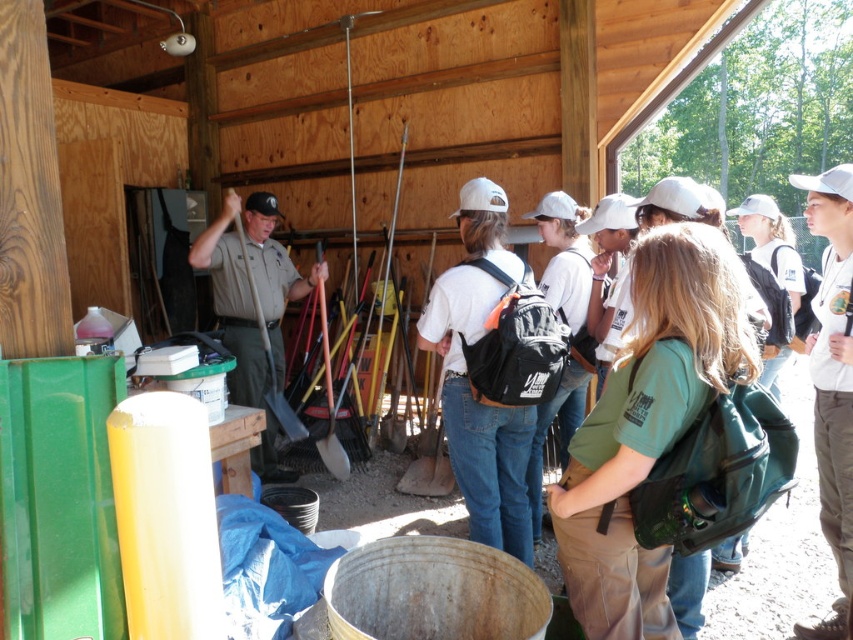
Does khaki uniform at center have a greater width compared to brushed metal shovel at center?

Yes.

In the scene shown: Does khaki uniform at center appear over brushed metal shovel at center?

Yes, khaki uniform at center is above brushed metal shovel at center.

You are a GUI agent. You are given a task and a screenshot of the screen. Output one action in this format:
    pyautogui.click(x=<x>, y=<y>)
    Task: Click on the khaki uniform at center
    This screenshot has width=853, height=640.
    Given the screenshot: What is the action you would take?
    pyautogui.click(x=250, y=291)

Is point (264, 348) farther from camera compared to point (318, 448)?

No, it is in front of (318, 448).

Is gray wooden shovel at center behind brushed metal shovel at center?

No, it is in front of brushed metal shovel at center.

Which is in front, point (241, 227) or point (320, 280)?

Point (241, 227) is in front.

Locate an element on the screen. gray wooden shovel at center is located at coordinates (270, 353).

Can you confirm if green fabric backpack at center is wider than khaki uniform at center?

No, green fabric backpack at center is not wider than khaki uniform at center.

Is the position of green fabric backpack at center less distant than that of khaki uniform at center?

Yes, it is in front of khaki uniform at center.

Measure the distance between point (688, 308) and camera.

Point (688, 308) is 5.92 feet away from camera.

The width and height of the screenshot is (853, 640). Find the location of `green fabric backpack at center`. green fabric backpack at center is located at coordinates (648, 424).